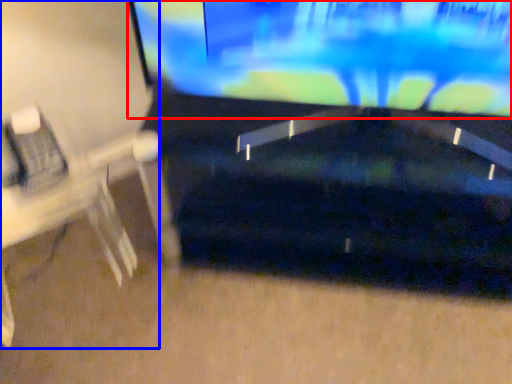
Question: Which object is further to the camera taking this photo, television (highlighted by a red box) or computer desk (highlighted by a blue box)?

Choices:
 (A) television
 (B) computer desk

Answer: (B)